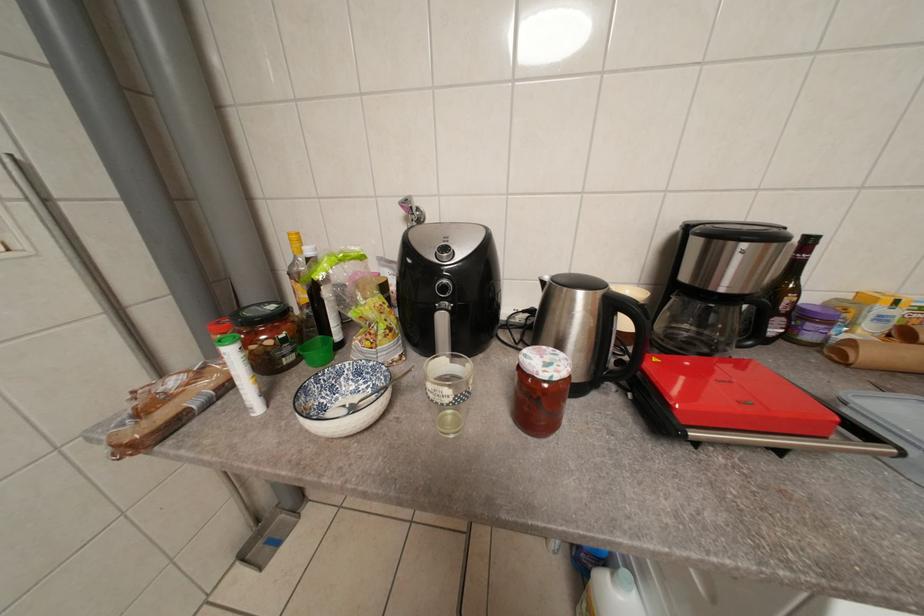
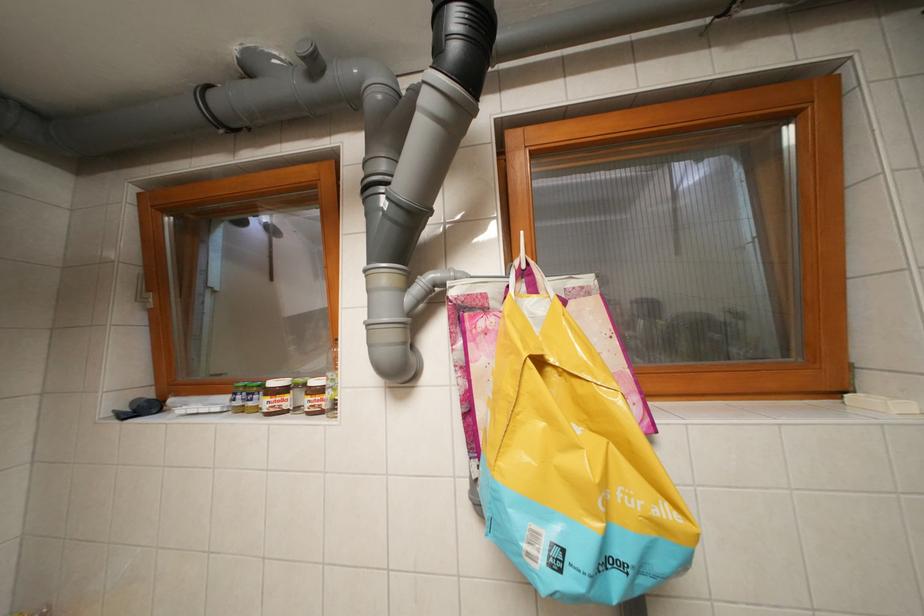
Question: The camera is either moving clockwise (left) or counter-clockwise (right) around the object. The first image is from the beginning of the video and the second image is from the end. Is the camera moving left or right when shooting the video?

Choices:
 (A) Left
 (B) Right

Answer: (B)